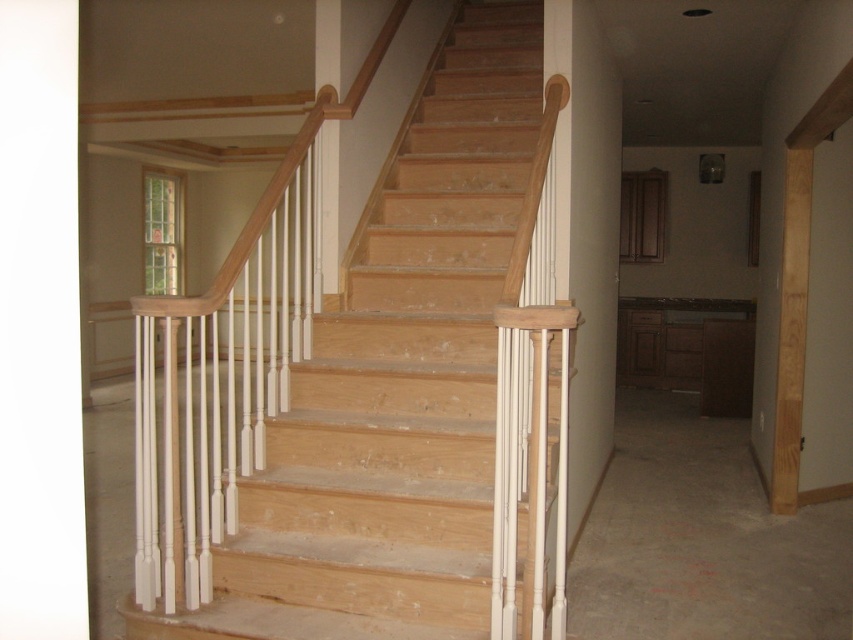
Question: In this image, where is white painted wood pillar at center located relative to white wood pillar at center?

Choices:
 (A) left
 (B) right

Answer: (B)

Question: Estimate the real-world distances between objects in this image. Which object is farther from the natural wood stairs at center?

Choices:
 (A) white painted wood pillar at center
 (B) white wood pillar at center

Answer: (B)

Question: Which point is closer to the camera?

Choices:
 (A) (326, 186)
 (B) (357, 326)

Answer: (B)

Question: Can you confirm if white painted wood pillar at center is positioned to the right of white wood pillar at center?

Choices:
 (A) no
 (B) yes

Answer: (B)

Question: Which point is farther from the camera taking this photo?

Choices:
 (A) (587, 129)
 (B) (367, 248)

Answer: (B)

Question: Is white painted wood pillar at center below white wood pillar at center?

Choices:
 (A) yes
 (B) no

Answer: (A)